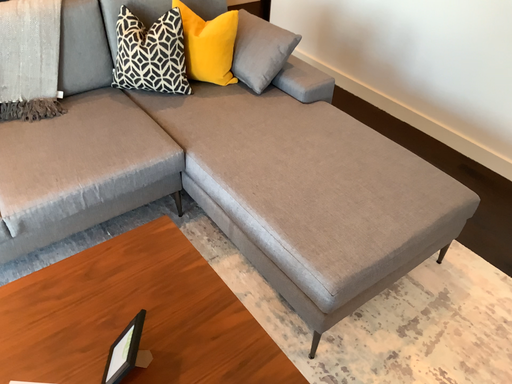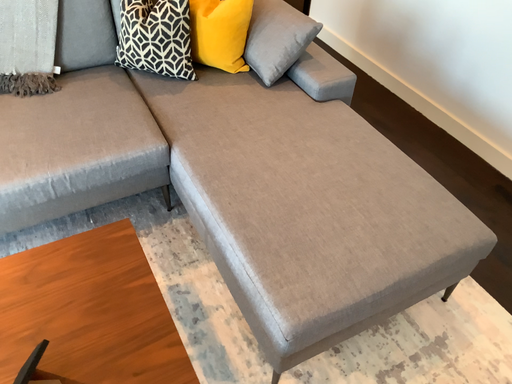
Question: Which way did the camera rotate in the video?

Choices:
 (A) rotated left
 (B) rotated right

Answer: (A)